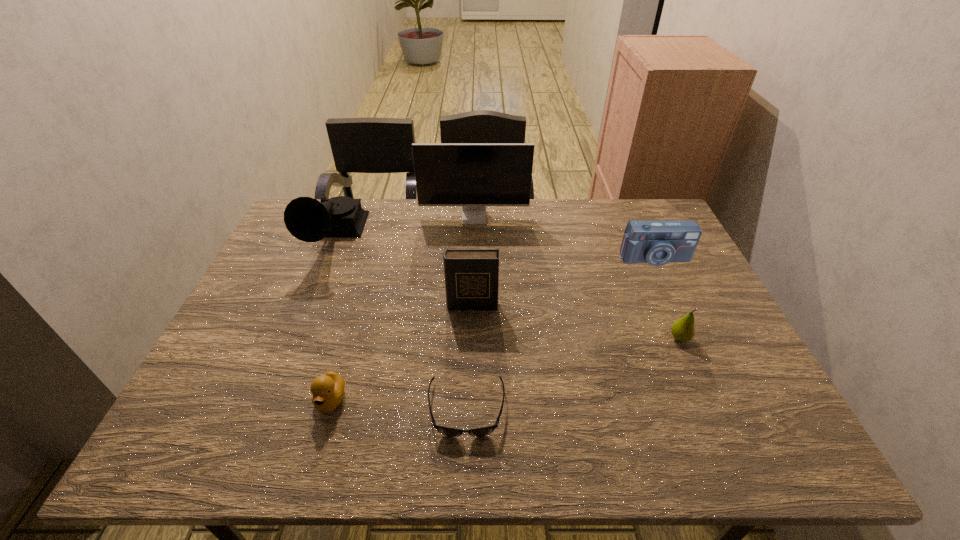
Identify the location of sunglasses. The width and height of the screenshot is (960, 540). (483, 431).

At what (x,y) coordinates should I click in order to perform the action: click on free space located on the front-facing side of the monitor. Please return your answer as a coordinate pair (x, y). Image resolution: width=960 pixels, height=540 pixels. Looking at the image, I should click on (473, 260).

At what (x,y) coordinates should I click in order to perform the action: click on free space located from the horn of the second tallest object. Please return your answer as a coordinate pair (x, y). This screenshot has height=540, width=960. Looking at the image, I should click on (303, 310).

This screenshot has width=960, height=540. In order to click on free location located 0.270m on the front cover of the diary in this screenshot , I will do `click(470, 401)`.

What are the coordinates of `vacant space located 0.280m on the lens of the camera` in the screenshot? It's located at (692, 343).

Identify the location of free space located on the front of the third nearest object. This screenshot has height=540, width=960. (694, 370).

The width and height of the screenshot is (960, 540). In order to click on blank area located 0.080m on the face of the second object from left to right in this screenshot , I will do `click(315, 457)`.

Locate an element on the screen. The image size is (960, 540). monitor present at the far edge is located at coordinates (473, 175).

Locate an element on the screen. The width and height of the screenshot is (960, 540). phonograph_record that is at the far edge is located at coordinates (307, 219).

Where is `duckling at the near edge`? This screenshot has height=540, width=960. duckling at the near edge is located at coordinates (327, 390).